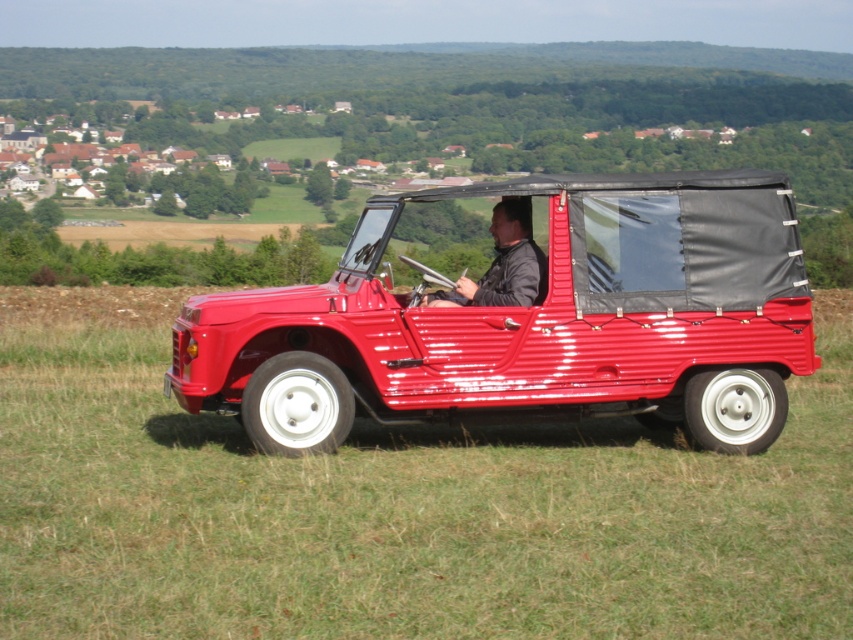
You are planning to drive a small toy car that is 10 cm wide. You want to drive it along the path between the glossy grass at center and the glossy red jeep at center. Can your toy car fit through that path?

The glossy grass at center might be wider than glossy red jeep at center, so the path between them could be wide enough for the toy car to pass through.

You are standing at the origin point of the coordinate system. You want to walk to the glossy grass at center. Which direction should you walk?

Since the glossy grass at center is located at coordinate point [403,515], you should walk towards the right and forward direction to reach it.